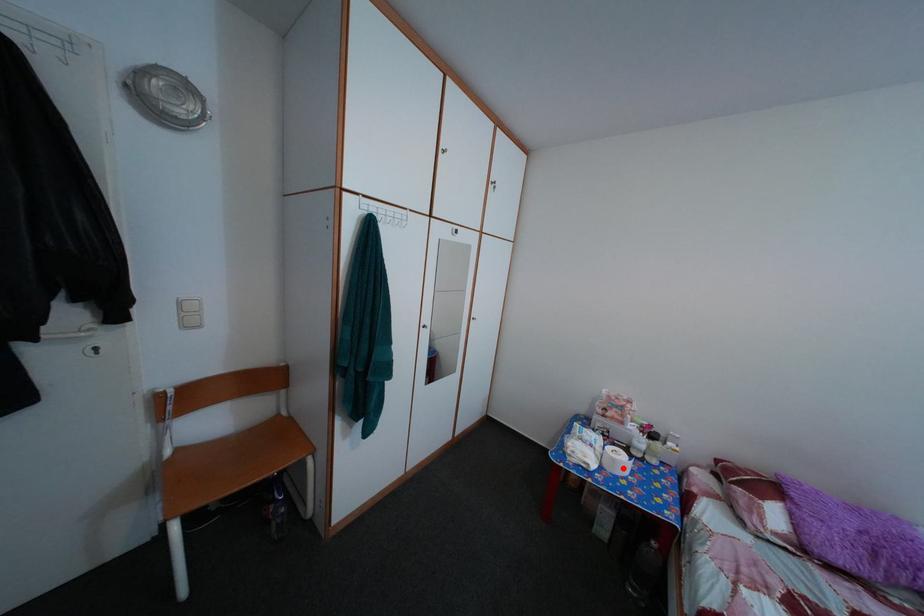
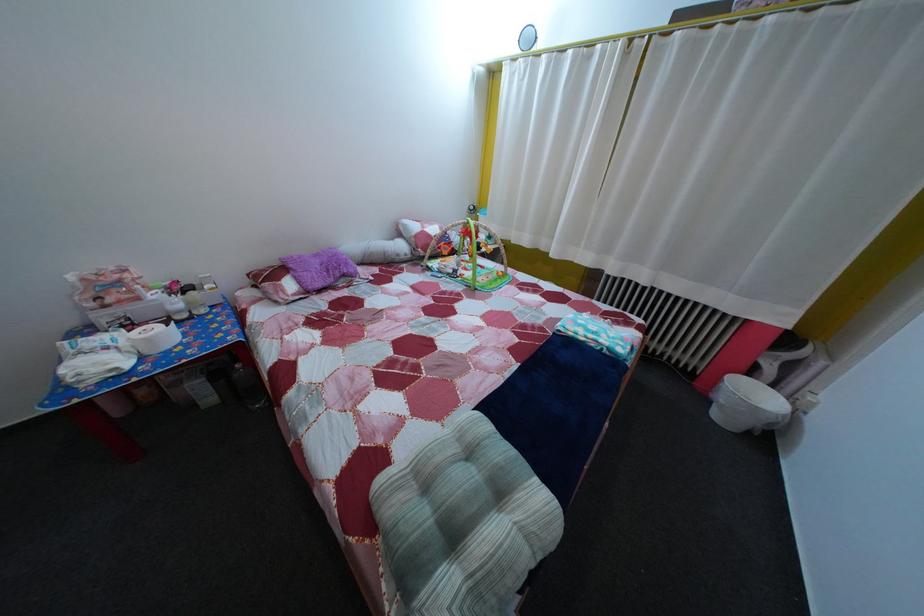
In the second image, find the point that corresponds to the highlighted location in the first image.

(157, 347)